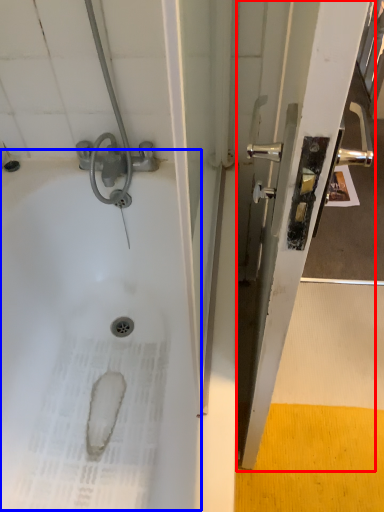
Question: Which of the following is the farthest to the observer, screen door (highlighted by a red box) or bath (highlighted by a blue box)?

Choices:
 (A) screen door
 (B) bath

Answer: (B)